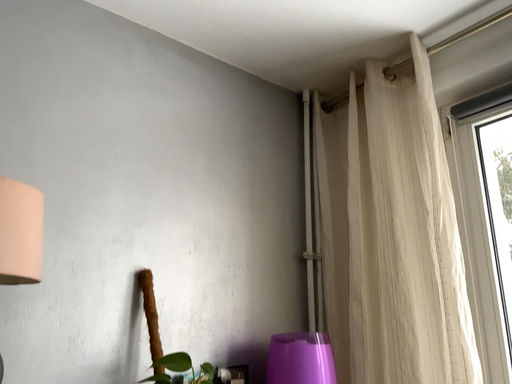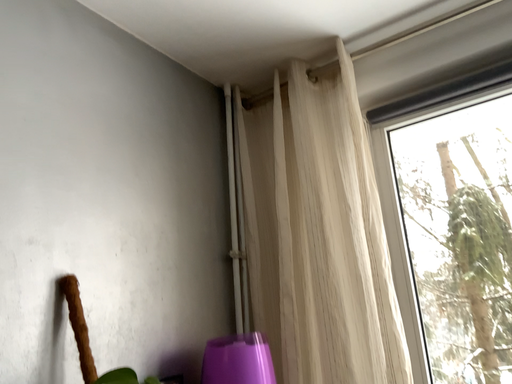
Question: How did the camera likely rotate when shooting the video?

Choices:
 (A) rotated left
 (B) rotated right

Answer: (B)